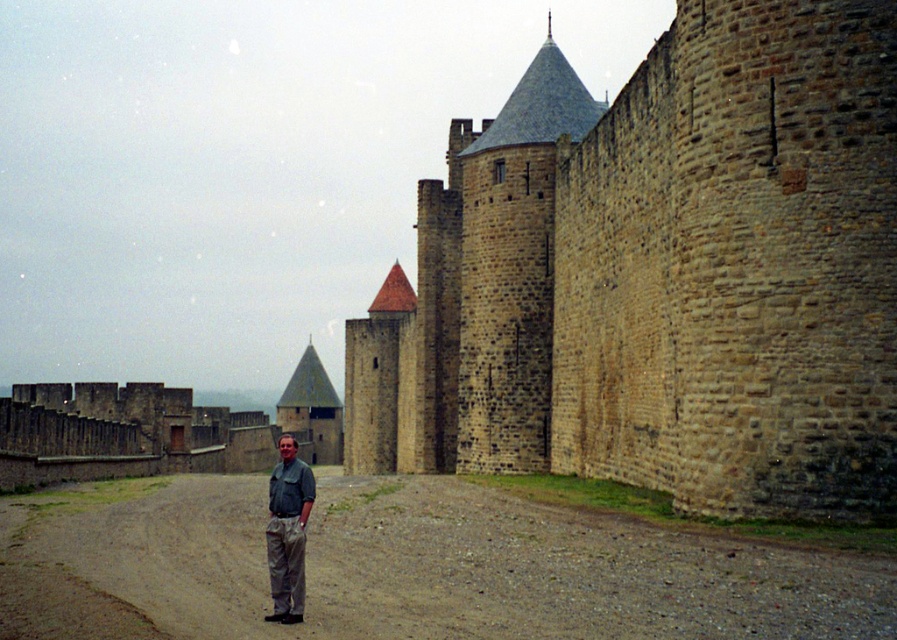
You are a photographer planning to capture a photo of the brown stone wall at center and the khaki pants at center. Which object is taller in the image?

The brown stone wall at center is taller than the khaki pants at center.

You are a tourist standing on the brown gravel road at center in Carcassonne. You want to touch the brown stone wall at center. Can you reach it without stepping off the gravel road?

The brown stone wall at center is positioned over the brown gravel road at center, so you can reach it while standing on the gravel road without needing to step off.

From the picture: You are a tourist in Carcassonne and want to take a photo of the medieval walls. You are standing on the brown gravel road at center. Where should you position yourself to capture the entire view of the walls and towers in your camera frame?

The brown gravel road at center is located at point (411,570), so you should position yourself at that coordinate to capture the entire view of the walls and towers in your camera frame.